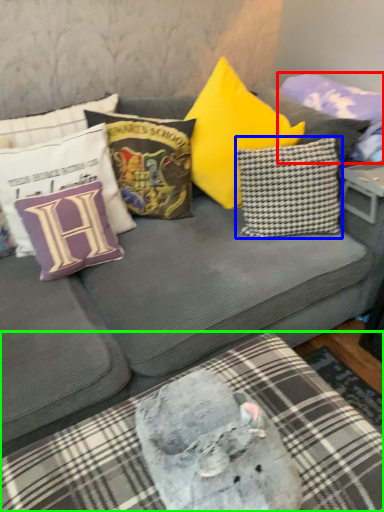
Question: Considering the real-world distances, which object is farthest from pillow (highlighted by a red box)? pillow (highlighted by a blue box) or bedding (highlighted by a green box)?

Choices:
 (A) pillow
 (B) bedding

Answer: (B)